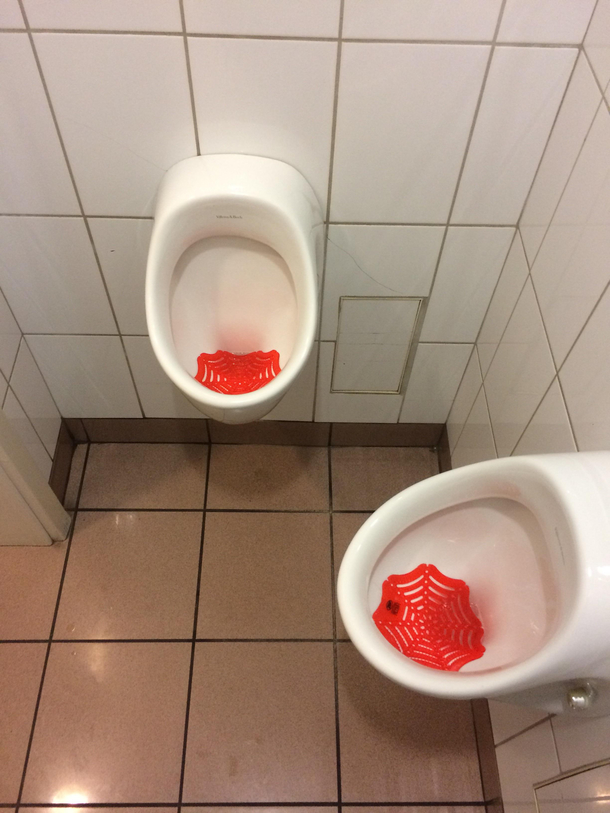
Where is `floor`? floor is located at coordinates (146, 615), (412, 770), (367, 470).